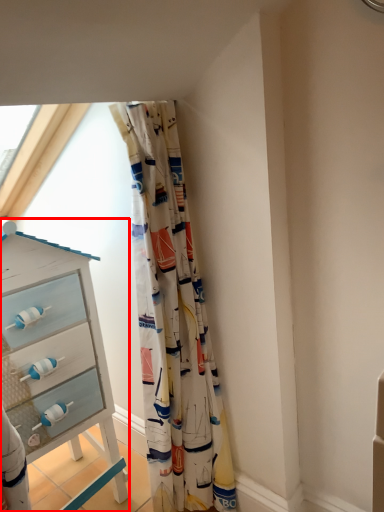
Question: Where is chest of drawers (annotated by the red box) located in relation to curtain in the image?

Choices:
 (A) left
 (B) right

Answer: (A)